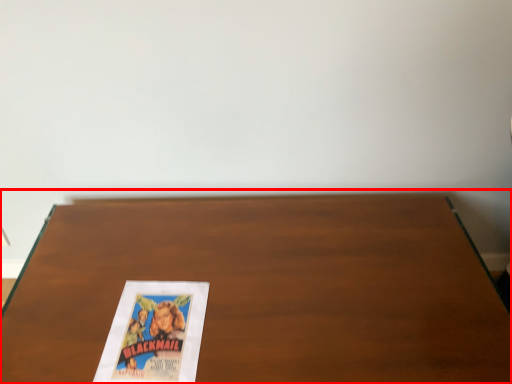
Question: From the image's perspective, what is the correct spatial positioning of table (annotated by the red box) in reference to paperback book?

Choices:
 (A) above
 (B) below

Answer: (B)